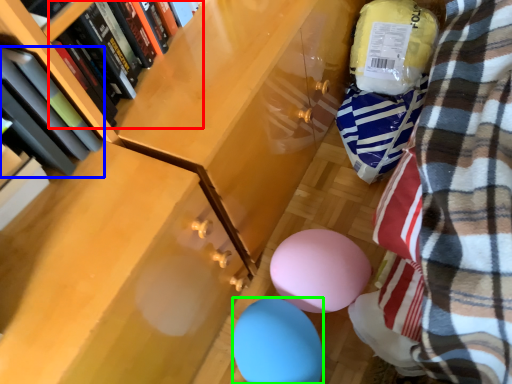
Question: Based on their relative distances, which object is farther from book (highlighted by a red box)? Choose from book (highlighted by a blue box) and balloon (highlighted by a green box).

Choices:
 (A) book
 (B) balloon

Answer: (B)